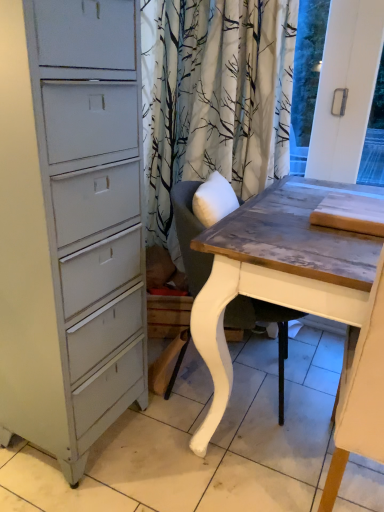
Question: Is wooden table at right not inside white painted wood chair at center?

Choices:
 (A) yes
 (B) no

Answer: (A)

Question: Is wooden table at right at the left side of white painted wood chair at center?

Choices:
 (A) no
 (B) yes

Answer: (A)

Question: Are wooden table at right and white painted wood chair at center far apart?

Choices:
 (A) no
 (B) yes

Answer: (A)

Question: Is wooden table at right thinner than white painted wood chair at center?

Choices:
 (A) no
 (B) yes

Answer: (A)

Question: Is wooden table at right positioned before white painted wood chair at center?

Choices:
 (A) no
 (B) yes

Answer: (B)

Question: Is white painted wood chair at center inside wooden table at right?

Choices:
 (A) yes
 (B) no

Answer: (B)

Question: Is white painted wood chair at center not close to wooden table at right?

Choices:
 (A) yes
 (B) no

Answer: (B)

Question: Is white painted wood chair at center touching wooden table at right?

Choices:
 (A) yes
 (B) no

Answer: (B)

Question: From the image's perspective, is white painted wood chair at center beneath wooden table at right?

Choices:
 (A) no
 (B) yes

Answer: (A)

Question: Is white painted wood chair at center at the right side of wooden table at right?

Choices:
 (A) yes
 (B) no

Answer: (B)

Question: Is wooden table at right at the back of white painted wood chair at center?

Choices:
 (A) no
 (B) yes

Answer: (A)

Question: Can you confirm if white painted wood chair at center is shorter than wooden table at right?

Choices:
 (A) yes
 (B) no

Answer: (A)

Question: From the image's perspective, is white painted wood chair at center above or below wooden table at right?

Choices:
 (A) below
 (B) above

Answer: (B)